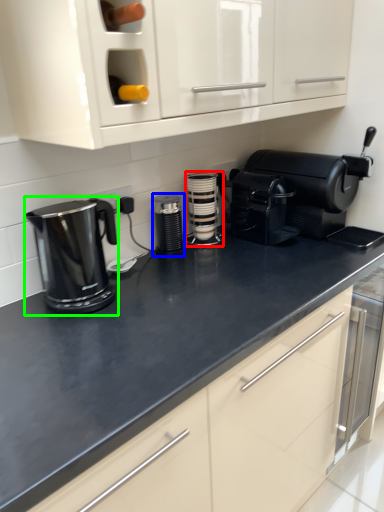
Question: Which is farther away from kitchen appliance (highlighted by a red box)? kitchen appliance (highlighted by a blue box) or home appliance (highlighted by a green box)?

Choices:
 (A) kitchen appliance
 (B) home appliance

Answer: (B)